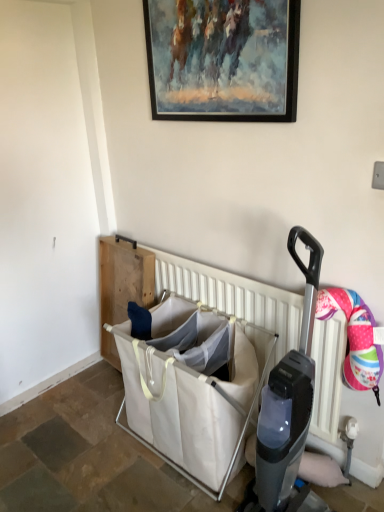
Question: Is painted wood picture frame at upper center positioned with its back to white canvas laundry basket at center?

Choices:
 (A) no
 (B) yes

Answer: (A)

Question: From a real-world perspective, is painted wood picture frame at upper center under white canvas laundry basket at center?

Choices:
 (A) yes
 (B) no

Answer: (B)

Question: Considering the relative positions of painted wood picture frame at upper center and white canvas laundry basket at center in the image provided, is painted wood picture frame at upper center to the right of white canvas laundry basket at center from the viewer's perspective?

Choices:
 (A) yes
 (B) no

Answer: (A)

Question: Can you see painted wood picture frame at upper center touching white canvas laundry basket at center?

Choices:
 (A) yes
 (B) no

Answer: (B)

Question: Are painted wood picture frame at upper center and white canvas laundry basket at center far apart?

Choices:
 (A) yes
 (B) no

Answer: (A)

Question: From the image's perspective, is painted wood picture frame at upper center beneath white canvas laundry basket at center?

Choices:
 (A) yes
 (B) no

Answer: (B)

Question: From a real-world perspective, is white plastic radiator at center under white canvas laundry basket at center?

Choices:
 (A) no
 (B) yes

Answer: (A)

Question: From the image's perspective, does white plastic radiator at center appear lower than white canvas laundry basket at center?

Choices:
 (A) no
 (B) yes

Answer: (A)

Question: Is white plastic radiator at center outside of white canvas laundry basket at center?

Choices:
 (A) no
 (B) yes

Answer: (B)

Question: Is white plastic radiator at center at the left side of white canvas laundry basket at center?

Choices:
 (A) yes
 (B) no

Answer: (B)

Question: Is white plastic radiator at center not near white canvas laundry basket at center?

Choices:
 (A) no
 (B) yes

Answer: (A)

Question: Considering the relative sizes of white plastic radiator at center and white canvas laundry basket at center in the image provided, is white plastic radiator at center shorter than white canvas laundry basket at center?

Choices:
 (A) yes
 (B) no

Answer: (B)

Question: From the image's perspective, is white canvas laundry basket at center located beneath painted wood picture frame at upper center?

Choices:
 (A) no
 (B) yes

Answer: (B)